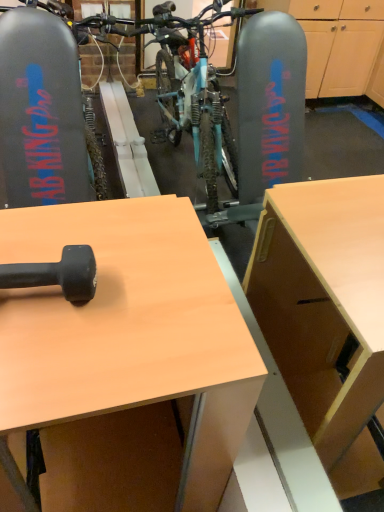
Where is `light brown wood desk at center`? This screenshot has width=384, height=512. light brown wood desk at center is located at coordinates (118, 314).

Describe the element at coordinates (118, 314) in the screenshot. This screenshot has height=512, width=384. I see `light brown wood desk at center` at that location.

What is the approximate height of light brown wood desk at center?

It is 35.81 inches.

Where is `black rubber dumbbell at upper left`? The height and width of the screenshot is (512, 384). black rubber dumbbell at upper left is located at coordinates (57, 274).

What do you see at coordinates (57, 274) in the screenshot? I see `black rubber dumbbell at upper left` at bounding box center [57, 274].

What is the approximate width of black rubber dumbbell at upper left?

It is 9.39 inches.

Locate an element on the screen. The height and width of the screenshot is (512, 384). light brown wood desk at center is located at coordinates pos(118,314).

Is black rubber dumbbell at upper left to the left or to the right of light brown wood desk at center in the image?

Based on their positions, black rubber dumbbell at upper left is located to the left of light brown wood desk at center.

Considering their positions, is black rubber dumbbell at upper left located in front of or behind light brown wood desk at center?

Visually, black rubber dumbbell at upper left is located behind light brown wood desk at center.

Based on the photo, which point is more distant from viewer, (17, 287) or (97, 297)?

The point (97, 297) is behind.

From the image's perspective, which one is positioned higher, black rubber dumbbell at upper left or light brown wood desk at center?

black rubber dumbbell at upper left appears higher in the image.

From a real-world perspective, is black rubber dumbbell at upper left on top of light brown wood desk at center?

Yes.

Between black rubber dumbbell at upper left and light brown wood desk at center, which one has smaller width?

black rubber dumbbell at upper left is thinner.

From the picture: Considering the sizes of black rubber dumbbell at upper left and light brown wood desk at center in the image, is black rubber dumbbell at upper left taller or shorter than light brown wood desk at center?

Considering their sizes, black rubber dumbbell at upper left has less height than light brown wood desk at center.

Can you confirm if black rubber dumbbell at upper left is bigger than light brown wood desk at center?

No, black rubber dumbbell at upper left is not bigger than light brown wood desk at center.

Does black rubber dumbbell at upper left contain light brown wood desk at center?

No, light brown wood desk at center is located outside of black rubber dumbbell at upper left.

Is black rubber dumbbell at upper left next to light brown wood desk at center and touching it?

No, black rubber dumbbell at upper left is not with light brown wood desk at center.

Could you tell me if black rubber dumbbell at upper left is turned towards light brown wood desk at center?

No, black rubber dumbbell at upper left is not facing towards light brown wood desk at center.

In order to click on dumbbell above the light brown wood desk at center (from the image's perspective) in this screenshot , I will do `click(57, 274)`.

Considering the relative positions of light brown wood desk at center and black rubber dumbbell at upper left in the image provided, is light brown wood desk at center to the right of black rubber dumbbell at upper left from the viewer's perspective?

Indeed, light brown wood desk at center is positioned on the right side of black rubber dumbbell at upper left.

Which object is further away from the camera, light brown wood desk at center or black rubber dumbbell at upper left?

→ Positioned behind is black rubber dumbbell at upper left.

Does point (151, 293) come in front of point (74, 278)?

That is False.

From the image's perspective, which one is positioned lower, light brown wood desk at center or black rubber dumbbell at upper left?

light brown wood desk at center is shown below in the image.

From a real-world perspective, which is physically below, light brown wood desk at center or black rubber dumbbell at upper left?

From a 3D spatial view, light brown wood desk at center is below.

Based on the photo, considering the relative sizes of light brown wood desk at center and black rubber dumbbell at upper left in the image provided, is light brown wood desk at center thinner than black rubber dumbbell at upper left?

Incorrect, the width of light brown wood desk at center is not less than that of black rubber dumbbell at upper left.

From their relative heights in the image, would you say light brown wood desk at center is taller or shorter than black rubber dumbbell at upper left?

Considering their sizes, light brown wood desk at center has more height than black rubber dumbbell at upper left.

Considering the sizes of objects light brown wood desk at center and black rubber dumbbell at upper left in the image provided, who is smaller, light brown wood desk at center or black rubber dumbbell at upper left?

black rubber dumbbell at upper left is smaller.

Is black rubber dumbbell at upper left inside light brown wood desk at center?

No.

Is light brown wood desk at center not close to black rubber dumbbell at upper left?

No, light brown wood desk at center is not far from black rubber dumbbell at upper left.

Could you tell me if light brown wood desk at center is turned towards black rubber dumbbell at upper left?

No, light brown wood desk at center is not facing towards black rubber dumbbell at upper left.

Identify the location of dumbbell that is above the light brown wood desk at center (from the image's perspective). (57, 274).

Image resolution: width=384 pixels, height=512 pixels. I want to click on desk that is on the right side of black rubber dumbbell at upper left, so click(x=118, y=314).

Where is `dumbbell above the light brown wood desk at center (from the image's perspective)`? This screenshot has width=384, height=512. dumbbell above the light brown wood desk at center (from the image's perspective) is located at coordinates coord(57,274).